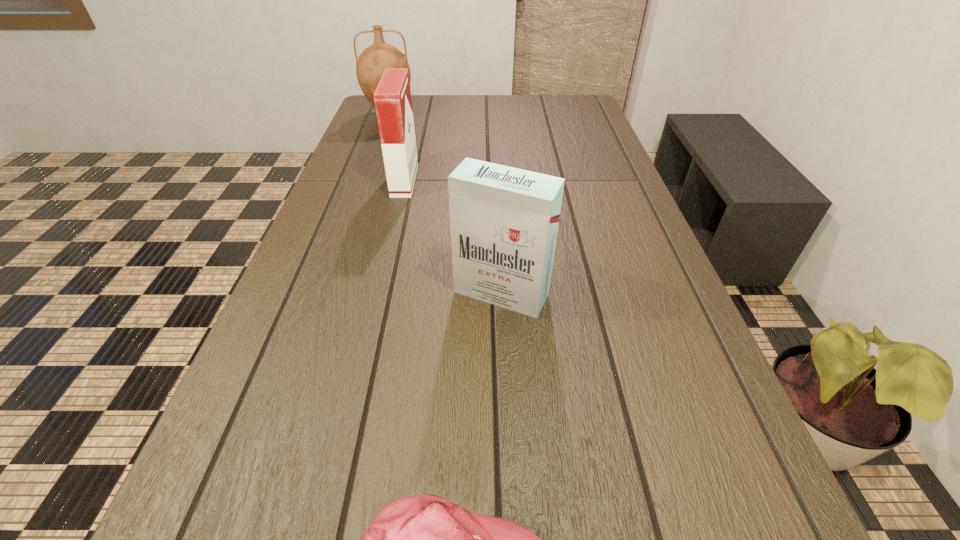
This screenshot has height=540, width=960. I want to click on pitcher, so click(370, 65).

At what (x,y) coordinates should I click in order to perform the action: click on the second farthest object. Please return your answer as a coordinate pair (x, y). Looking at the image, I should click on (392, 97).

Where is `the left cigarette case`? The width and height of the screenshot is (960, 540). the left cigarette case is located at coordinates (392, 97).

Where is `the third farthest object`? the third farthest object is located at coordinates (504, 221).

Locate an element on the screen. the nearer cigarette case is located at coordinates (504, 221).

Where is `free location located on the front of the pitcher`? The image size is (960, 540). free location located on the front of the pitcher is located at coordinates (380, 141).

Where is `free spot located 0.250m on the front-facing side of the left cigarette case`? The image size is (960, 540). free spot located 0.250m on the front-facing side of the left cigarette case is located at coordinates (509, 180).

Locate an element on the screen. The height and width of the screenshot is (540, 960). vacant space located 0.140m on the front of the right cigarette case is located at coordinates (506, 383).

Find the location of a particular element. This screenshot has height=540, width=960. object that is at the far edge is located at coordinates (370, 65).

Where is `pitcher at the left edge`? The height and width of the screenshot is (540, 960). pitcher at the left edge is located at coordinates (370, 65).